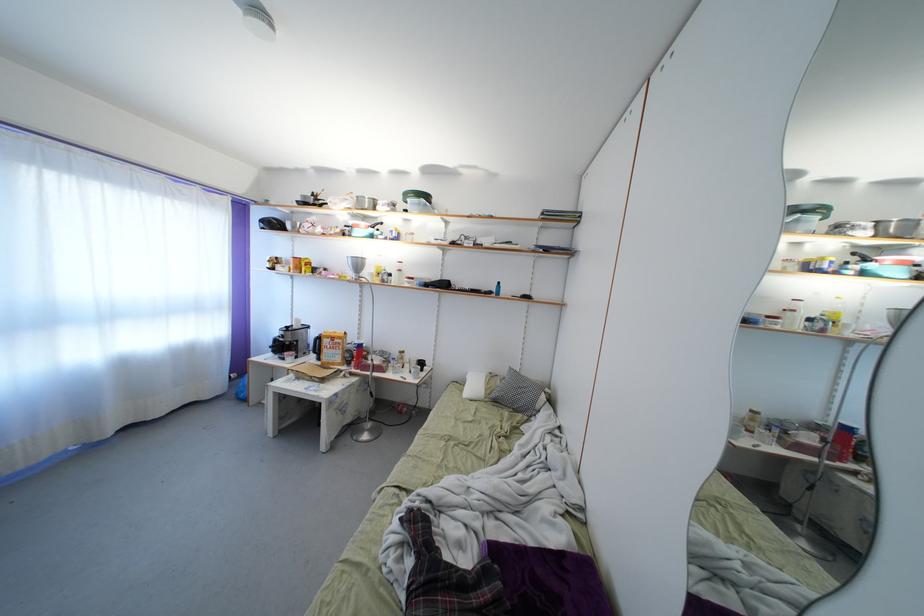
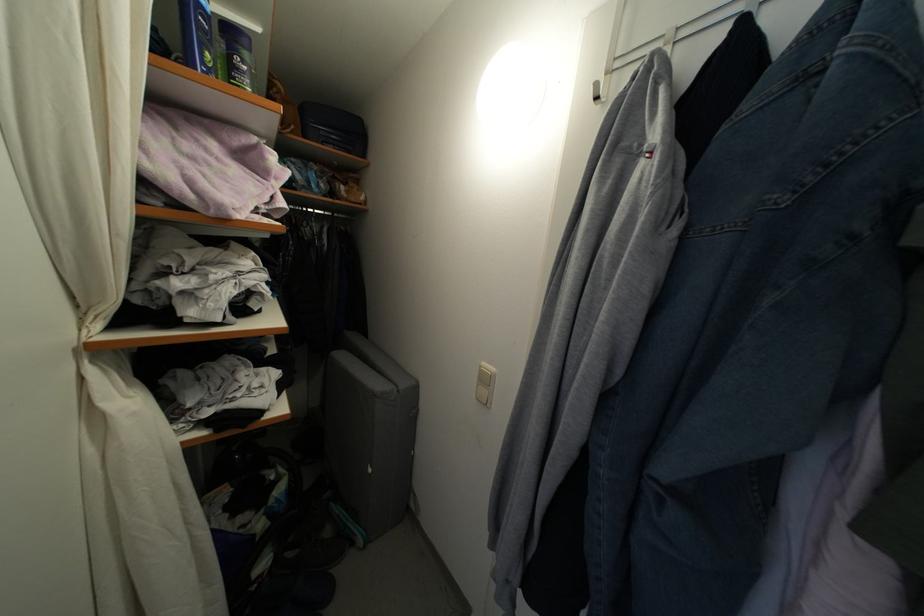
Question: Based on the continuous images, in which direction is the camera rotating? Reply with the corresponding letter.

Choices:
 (A) Left
 (B) Right
 (C) Up
 (D) Down

Answer: (B)